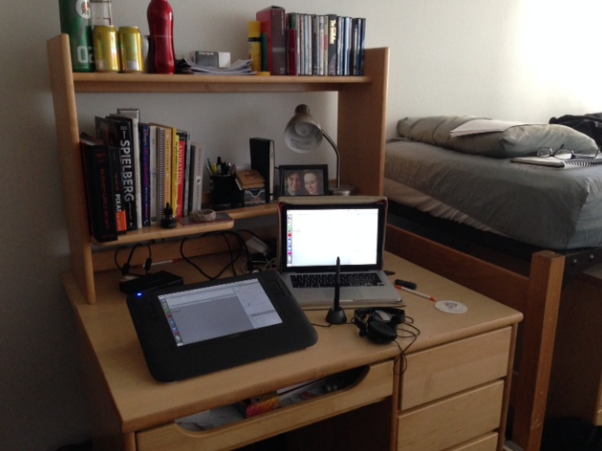
This screenshot has height=451, width=602. Identify the location of drawer. (450, 363).